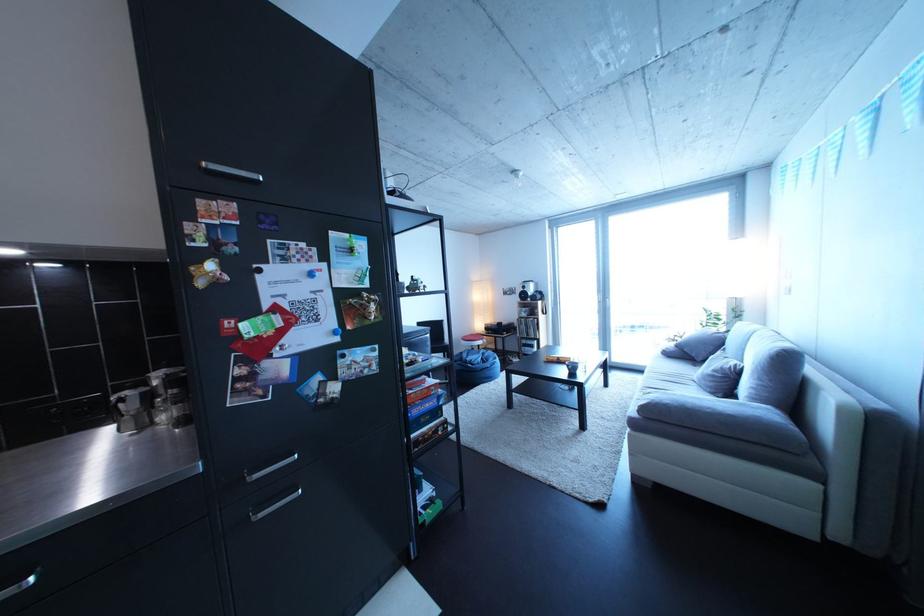
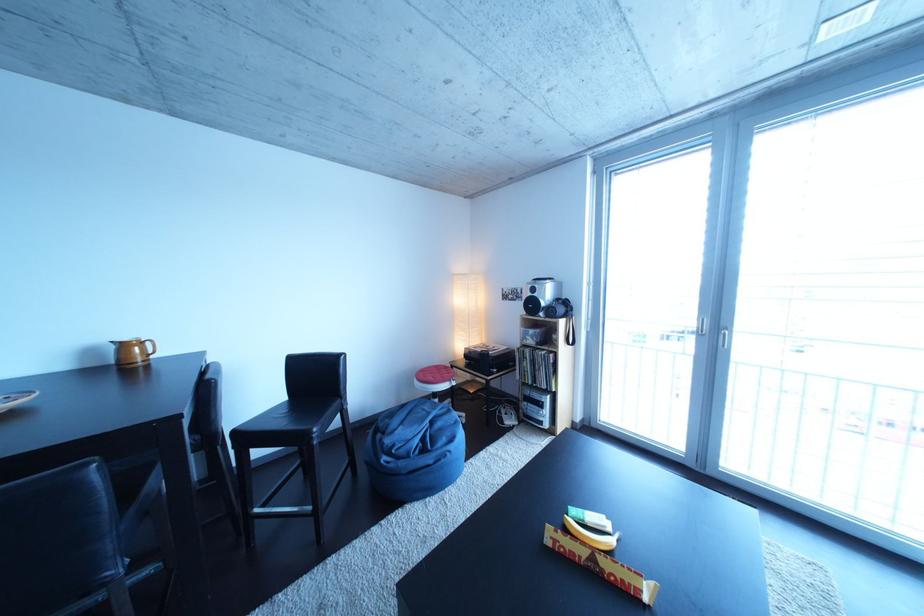
In the second image, find the point that corresponds to point 477,347 in the first image.

(430, 387)